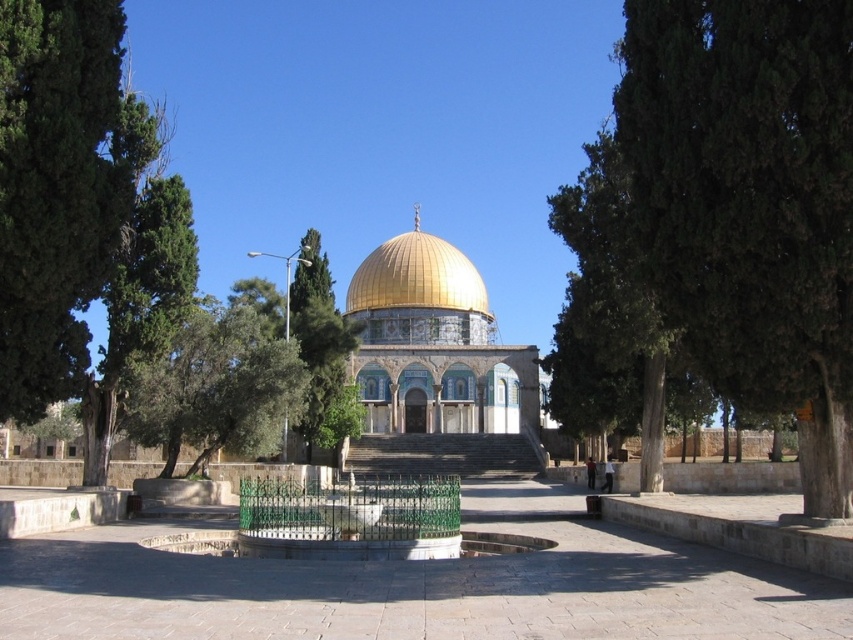
Question: Can you confirm if green leafy tree at left is positioned above gray stone stairs at center?

Choices:
 (A) no
 (B) yes

Answer: (B)

Question: Which point is closer to the camera?

Choices:
 (A) green textured tree at right
 (B) gray stone stairs at center
 (C) green leafy tree at center
 (D) green leafy tree at left

Answer: (A)

Question: Which object appears closest to the camera in this image?

Choices:
 (A) green textured tree at right
 (B) green leafy tree at left
 (C) gray stone stairs at center
 (D) green leafy tree at center

Answer: (A)

Question: Can you confirm if green leafy tree at left is thinner than green leafy tree at center?

Choices:
 (A) no
 (B) yes

Answer: (B)

Question: Considering the real-world distances, which object is farthest from the gray stone stairs at center?

Choices:
 (A) green leafy tree at left
 (B) green textured tree at right
 (C) gold metallic dome at center

Answer: (A)

Question: Is the position of green textured tree at right less distant than that of gold metallic dome at center?

Choices:
 (A) yes
 (B) no

Answer: (A)